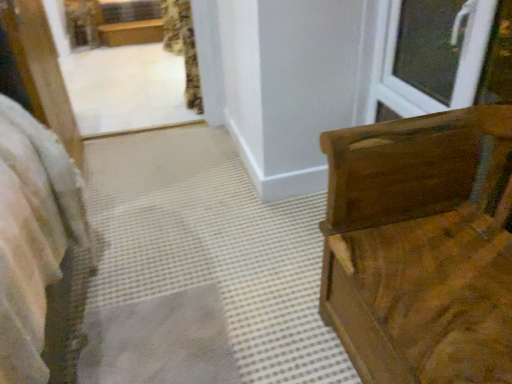
Question: Visually, is floral fabric curtain at upper center positioned to the left or to the right of wooden chest at right?

Choices:
 (A) right
 (B) left

Answer: (B)

Question: From their relative heights in the image, would you say floral fabric curtain at upper center is taller or shorter than wooden chest at right?

Choices:
 (A) tall
 (B) short

Answer: (B)

Question: Estimate the real-world distances between objects in this image. Which object is closer to the wooden chest at right?

Choices:
 (A) floral fabric curtain at upper center
 (B) white plastic window at upper right

Answer: (B)

Question: Which object is the closest to the floral fabric curtain at upper center?

Choices:
 (A) wooden chest at right
 (B) white plastic window at upper right

Answer: (B)